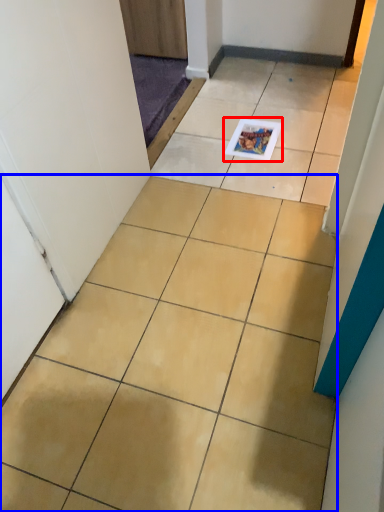
Question: Which point is closer to the camera, magazine (highlighted by a red box) or ceramic tile (highlighted by a blue box)?

Choices:
 (A) magazine
 (B) ceramic tile

Answer: (B)